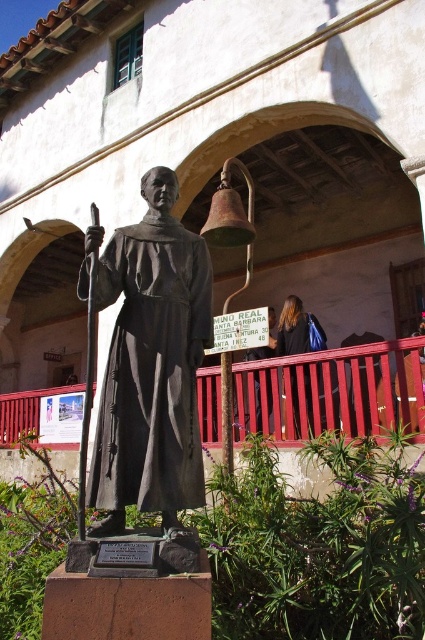
You are a tour guide leading a group to a statue located 6 meters away from the MONO REAL sign. Can you safely walk between the matte black robe at center and the blonde hair at upper right to reach the statue without getting too close to either?

The distance between the matte black robe at center and the blonde hair at upper right is 5.80 meters, which is slightly less than the 6 meters required to reach the statue. Therefore, you cannot safely walk between them without getting too close.

You are a visitor at the site and want to take a photo of the statue. You notice the matte black robe at center and the blonde hair at upper right. Which part of the statue should you focus on to capture the taller feature in your photo?

The matte black robe at center is taller than the blonde hair at upper right, so you should focus on the matte black robe at center to capture the taller feature in your photo.

You are standing in front of the statue and want to touch the matte black robe at center. Can you reach it without crossing the red railing?

The matte black robe at center is positioned at point (152, 369), which is on the statue itself. Since the statue is in the foreground and the railing is behind it, you can reach the matte black robe at center without crossing the red railing.